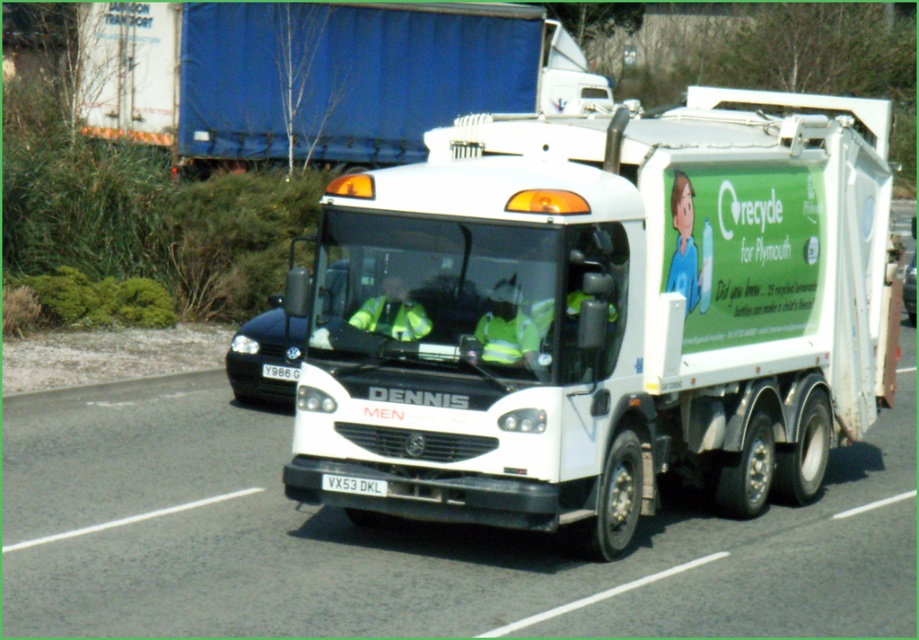
Is point (302, 316) closer to camera compared to point (417, 312)?

No, it is not.

Does black glossy car at left appear on the right side of high visibility reflective jacket at center?

Incorrect, black glossy car at left is not on the right side of high visibility reflective jacket at center.

Which is behind, point (236, 387) or point (422, 316)?

The point (236, 387) is behind.

What are the coordinates of `black glossy car at left` in the screenshot? It's located at (267, 356).

In the scene shown: Is reflective yellow vest at center to the left of high visibility reflective jacket at center from the viewer's perspective?

No, reflective yellow vest at center is not to the left of high visibility reflective jacket at center.

Is reflective yellow vest at center to the right of high visibility reflective jacket at center from the viewer's perspective?

Yes, reflective yellow vest at center is to the right of high visibility reflective jacket at center.

Locate an element on the screen. This screenshot has width=919, height=640. reflective yellow vest at center is located at coordinates (507, 330).

Does white glossy garbage truck at center appear over black glossy car at left?

Yes.

Does point (353, 296) come in front of point (284, 360)?

Yes, it is in front of point (284, 360).

Identify the location of white glossy garbage truck at center. The height and width of the screenshot is (640, 919). (604, 316).